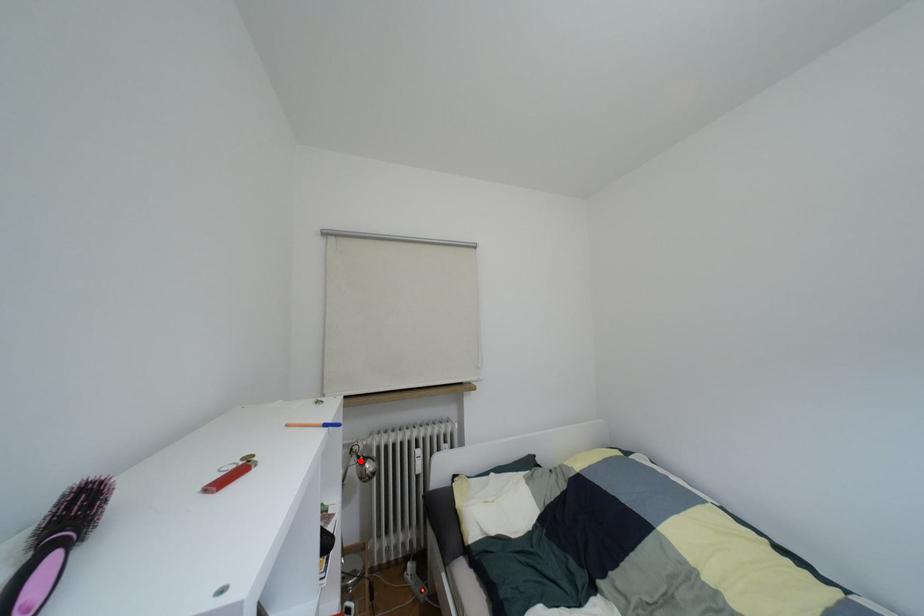
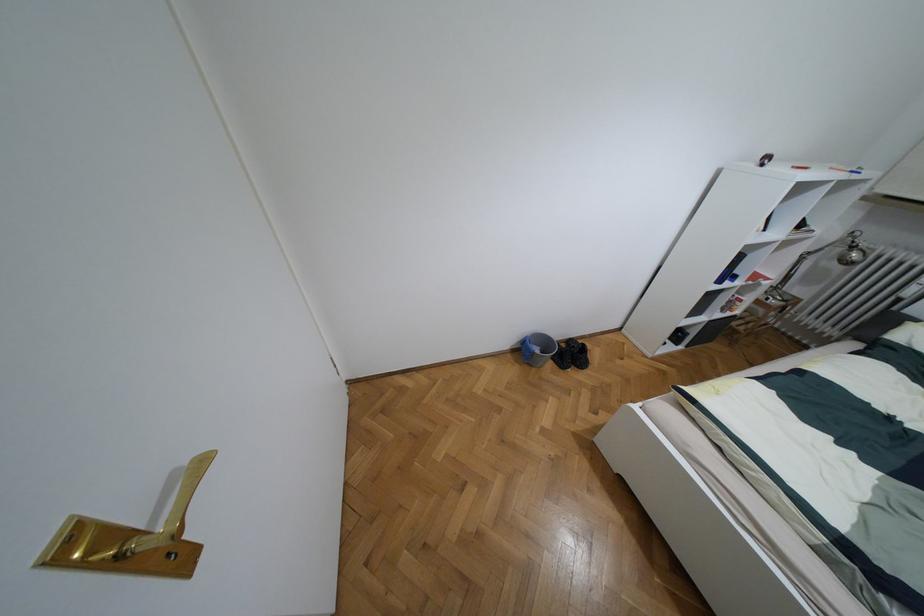
Question: A red point is marked in image1. In image2, is the corresponding 3D point closer to the camera or farther? Reply with the corresponding letter.

Choices:
 (A) The corresponding 3D point is closer.
 (B) The corresponding 3D point is farther.

Answer: (B)